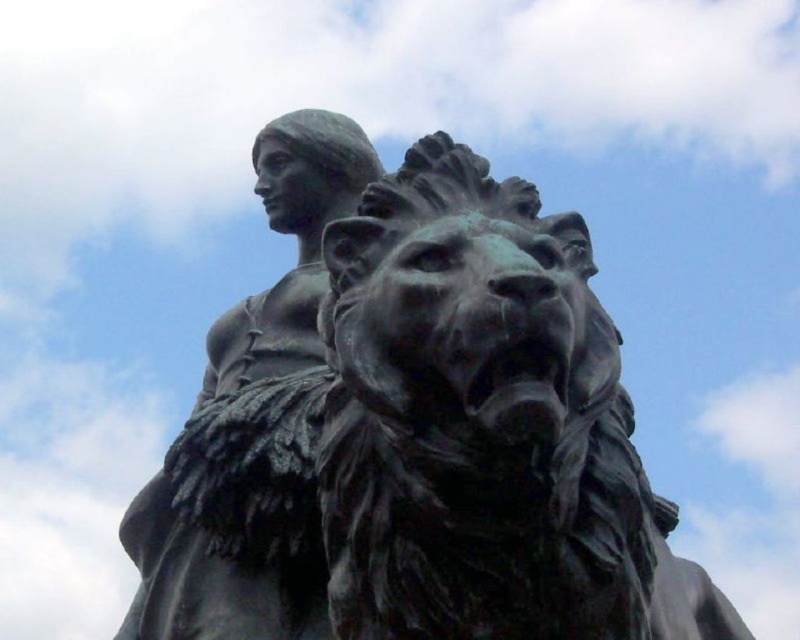
Question: Which of the following is the farthest from the observer?

Choices:
 (A) (276, 184)
 (B) (458, 561)

Answer: (A)

Question: Does bronze statue at center come in front of matte bronze statue at upper left?

Choices:
 (A) no
 (B) yes

Answer: (B)

Question: Does bronze statue at center have a greater width compared to matte bronze statue at upper left?

Choices:
 (A) no
 (B) yes

Answer: (B)

Question: Which point is closer to the camera?

Choices:
 (A) (544, 275)
 (B) (322, 216)

Answer: (A)

Question: Considering the relative positions of bronze statue at center and matte bronze statue at upper left in the image provided, where is bronze statue at center located with respect to matte bronze statue at upper left?

Choices:
 (A) left
 (B) right

Answer: (B)

Question: Among these objects, which one is farthest from the camera?

Choices:
 (A) matte bronze statue at upper left
 (B) bronze statue at center

Answer: (A)